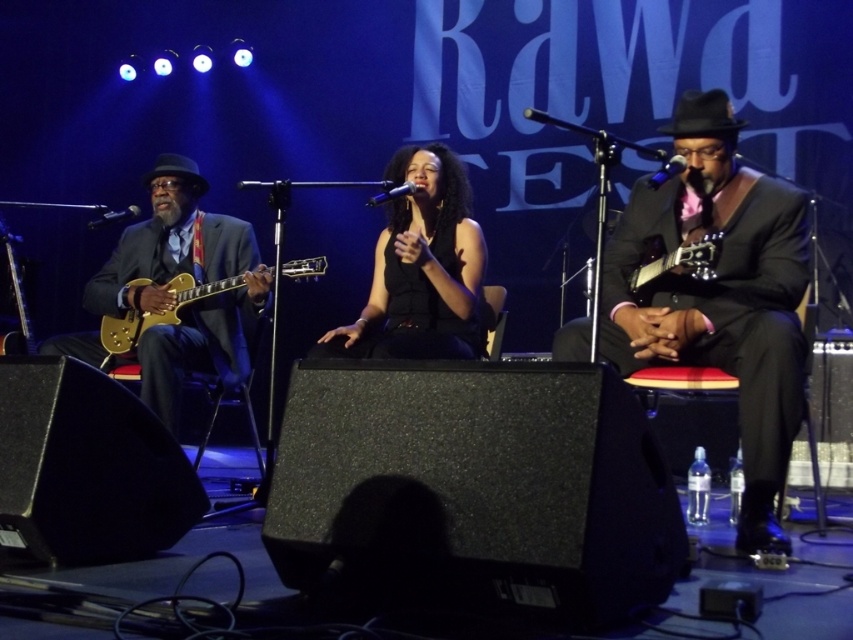
You are a photographer at the Raw music festival trying to capture the best shot of the stage. You notice two points on the stage marked as point (618, 244) and point (674, 157). Which point is closer to your camera?

Point (674, 157) is closer to the camera because it is less further than point (618, 244).

You are a sound technician at the festival. You need to choose a microphone that is smaller to place on a narrow stand. Which one between the black metallic microphone at center and the black matte microphone at left should you choose?

The black matte microphone at left is smaller than the black metallic microphone at center, so you should choose the black matte microphone at left for the narrow stand.

You are a photographer at the music festival and need to position your camera to capture the shiny black suit at center. According to the coordinates provided, where should you aim your camera?

The shiny black suit at center is located at point (x=718, y=294), so you should aim your camera at those coordinates to capture it accurately.